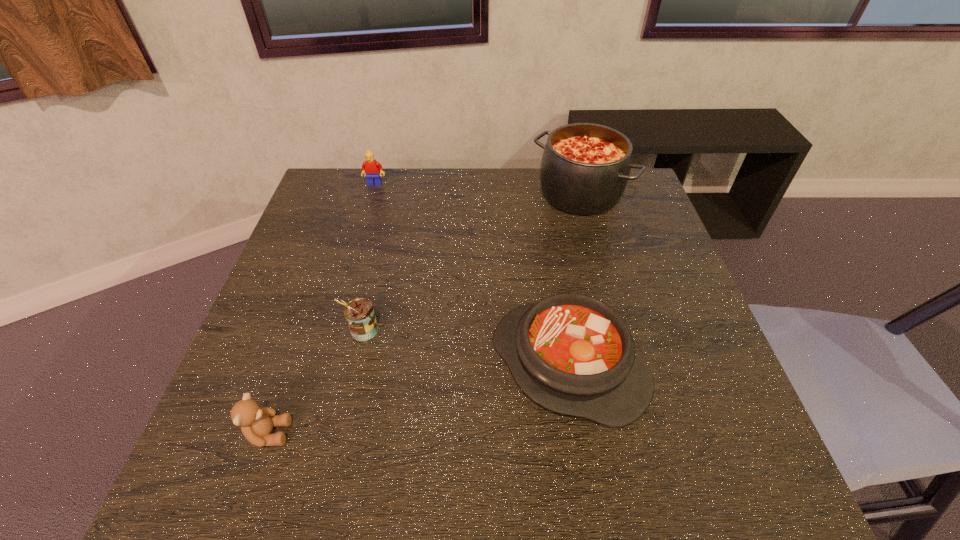
I want to click on free location that satisfies the following two spatial constraints: 1. on the face of the shorter casserole; 2. on the right side of the Lego, so click(x=323, y=366).

Find the location of a particular element. This screenshot has height=540, width=960. free space that satisfies the following two spatial constraints: 1. on the face of the Lego; 2. on the face of the teddy bear is located at coordinates (303, 433).

In order to click on vacant space that satisfies the following two spatial constraints: 1. on the face of the farther casserole; 2. on the right side of the Lego in this screenshot , I will do `click(372, 194)`.

This screenshot has height=540, width=960. I want to click on free location that satisfies the following two spatial constraints: 1. on the face of the shorter casserole; 2. on the right side of the Lego, so click(x=323, y=366).

Identify the location of vacant region that satisfies the following two spatial constraints: 1. on the face of the Lego; 2. on the right side of the nearer casserole. (323, 366).

The height and width of the screenshot is (540, 960). Identify the location of vacant area in the image that satisfies the following two spatial constraints: 1. on the face of the Lego; 2. on the left side of the can. (333, 330).